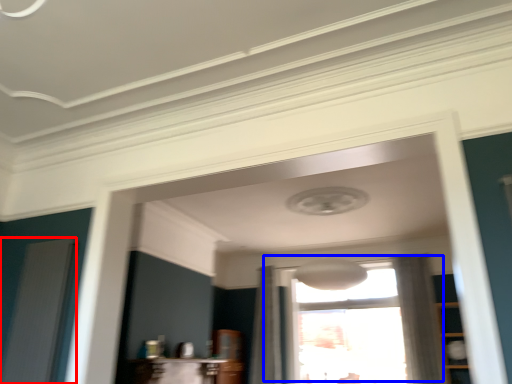
Question: Which object is further to the camera taking this photo, screen door (highlighted by a red box) or window (highlighted by a blue box)?

Choices:
 (A) screen door
 (B) window

Answer: (B)